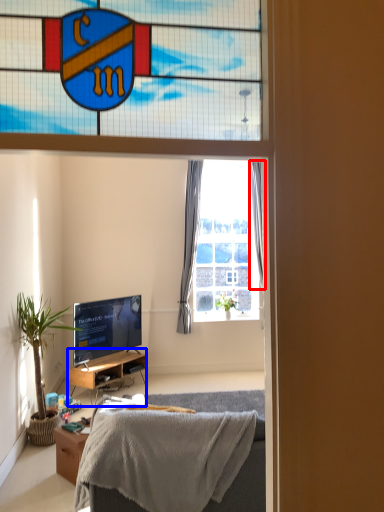
Question: Which object appears farthest to the camera in this image, curtain (highlighted by a red box) or cabinetry (highlighted by a blue box)?

Choices:
 (A) curtain
 (B) cabinetry

Answer: (A)